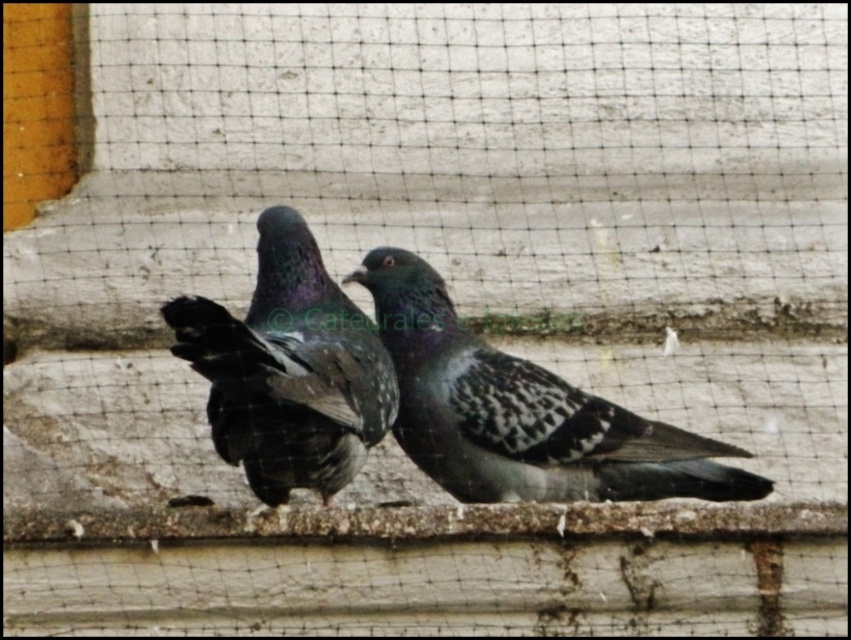
You are a birdwatcher observing two pigeons on a concrete ledge. You notice a speckled feathered pigeon at center and a shiny dark feathers at center. Which pigeon is smaller in size?

The speckled feathered pigeon at center is smaller in size compared to the shiny dark feathers at center.

In the scene shown: You are a birdwatcher observing two pigeons on a ledge. You notice a speckled feathered pigeon at center and a shiny dark feathers at center. Which pigeon is closer to you?

The speckled feathered pigeon at center is closer to you because the shiny dark feathers at center is behind it.

You are a birdwatcher observing two pigeons on a ledge. You notice a speckled feathered pigeon at center and a shiny dark feathers at center. Which of these two has a greater width?

The speckled feathered pigeon at center might be wider than shiny dark feathers at center according to the description.